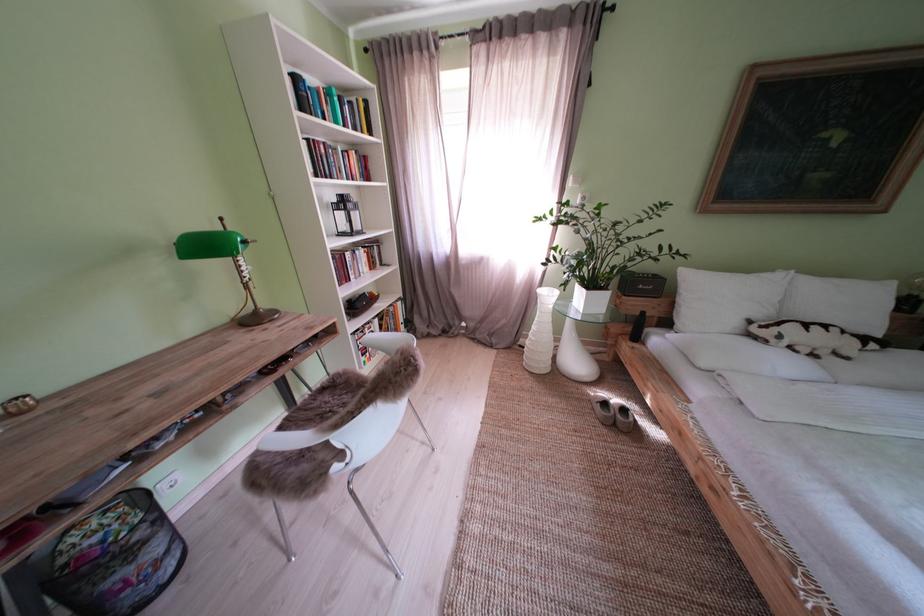
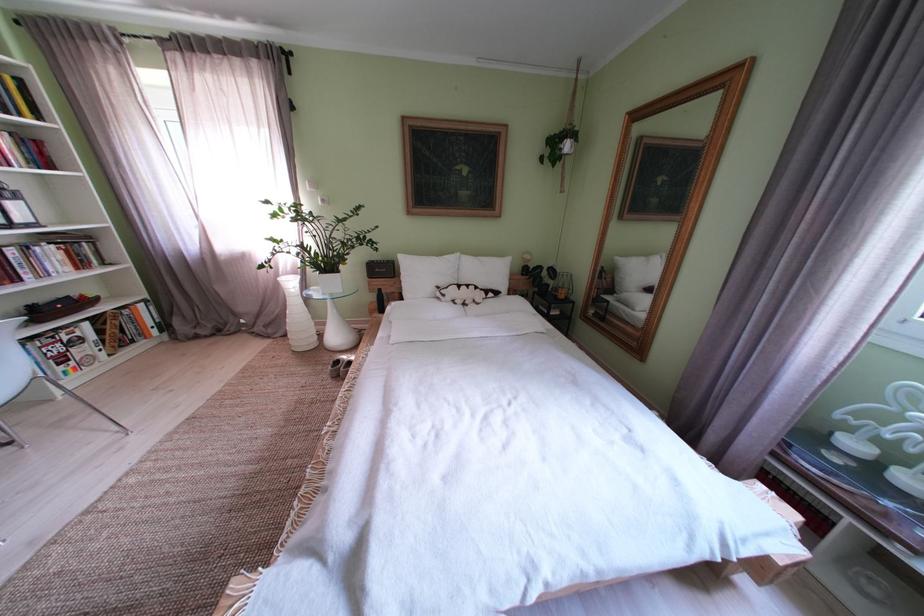
The point at (369,257) is marked in the first image. Where is the corresponding point in the second image?

(49, 254)